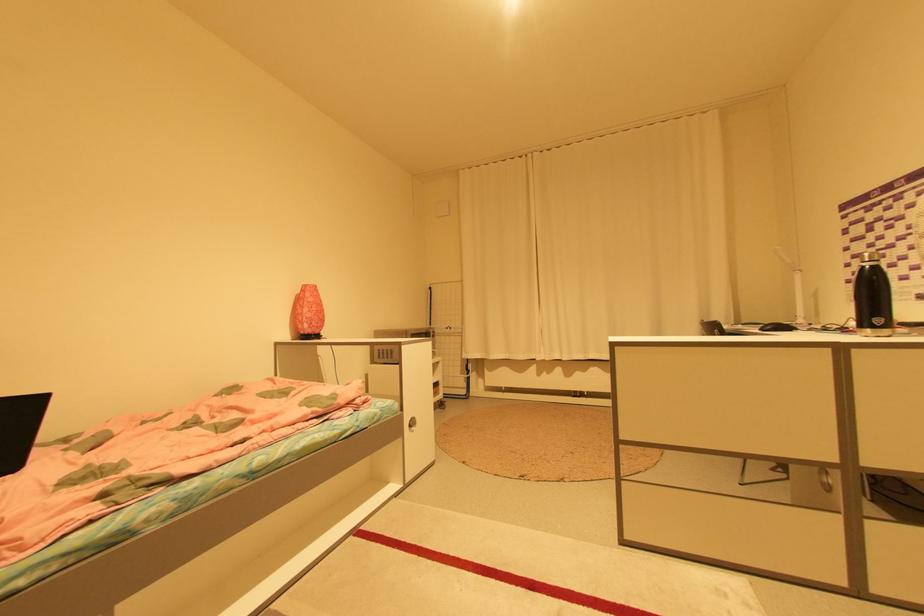
I want to click on black water bottle, so click(871, 298).